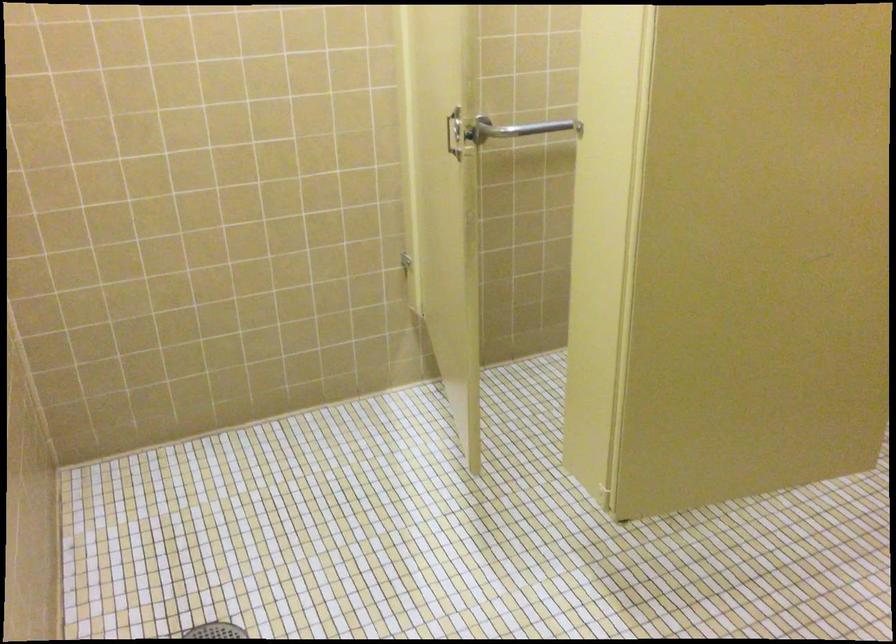
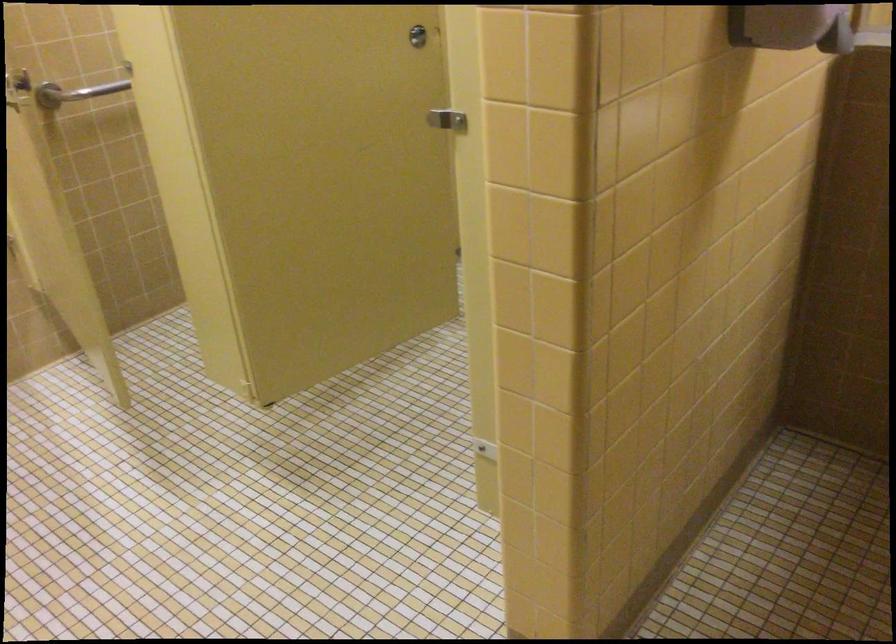
Where in the second image is the point corresponding to the point at 504,124 from the first image?

(75, 91)